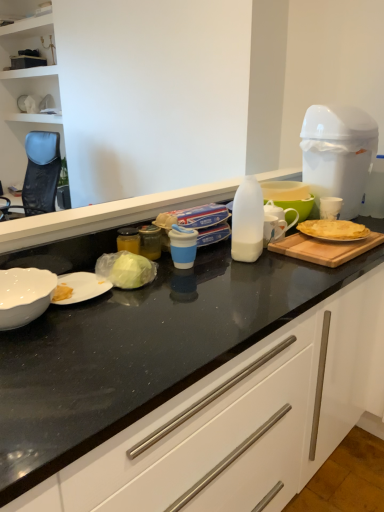
Question: From a real-world perspective, is white plastic trash can at upper right physically located above or below golden crispy crepe at right?

Choices:
 (A) below
 (B) above

Answer: (B)

Question: Is point (365, 121) closer or farther from the camera than point (354, 231)?

Choices:
 (A) closer
 (B) farther

Answer: (B)

Question: Which object is the closest to the golden crispy crepe at right?

Choices:
 (A) wooden cutting board at right
 (B) white glossy bowl at lower left
 (C) translucent plastic milk bottle at center
 (D) white glossy countertop at center
 (E) white plastic trash can at upper right

Answer: (A)

Question: Based on their relative distances, which object is farther from the white glossy countertop at center?

Choices:
 (A) white plastic trash can at upper right
 (B) wooden cutting board at right
 (C) translucent plastic milk bottle at center
 (D) golden crispy crepe at right
 (E) white glossy bowl at lower left

Answer: (A)